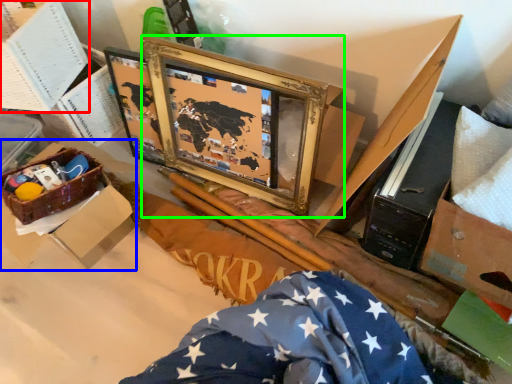
Question: Considering the real-world distances, which object is closest to box (highlighted by a red box)? box (highlighted by a blue box) or picture frame (highlighted by a green box).

Choices:
 (A) box
 (B) picture frame

Answer: (A)